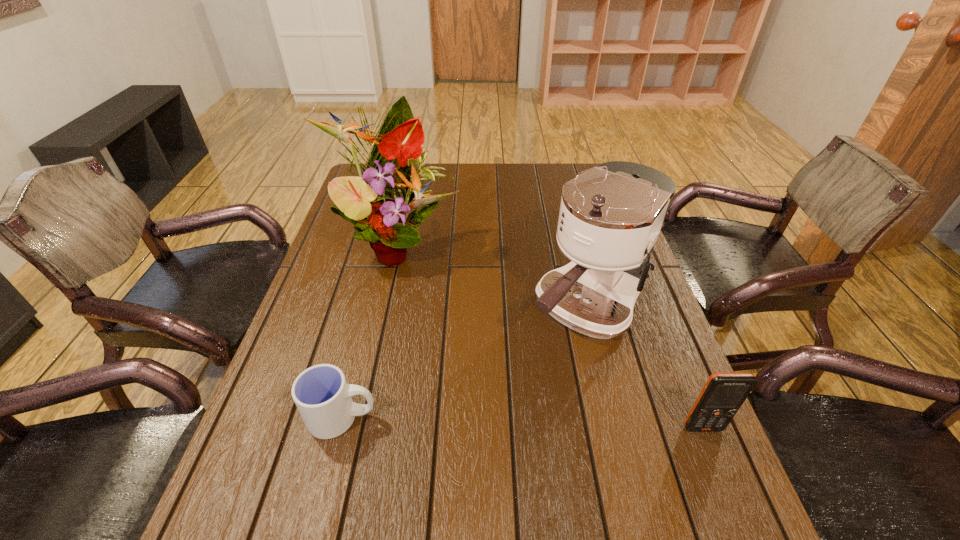
Locate an element on the screen. This screenshot has width=960, height=540. free space on the desktop that is between the cup and the second shortest object and is positioned on the front-facing side of the coffee maker is located at coordinates (479, 422).

Where is `vacant space on the desktop that is between the cup and the second shortest object and is positioned on the front-facing side of the bouquet`? vacant space on the desktop that is between the cup and the second shortest object and is positioned on the front-facing side of the bouquet is located at coordinates (542, 423).